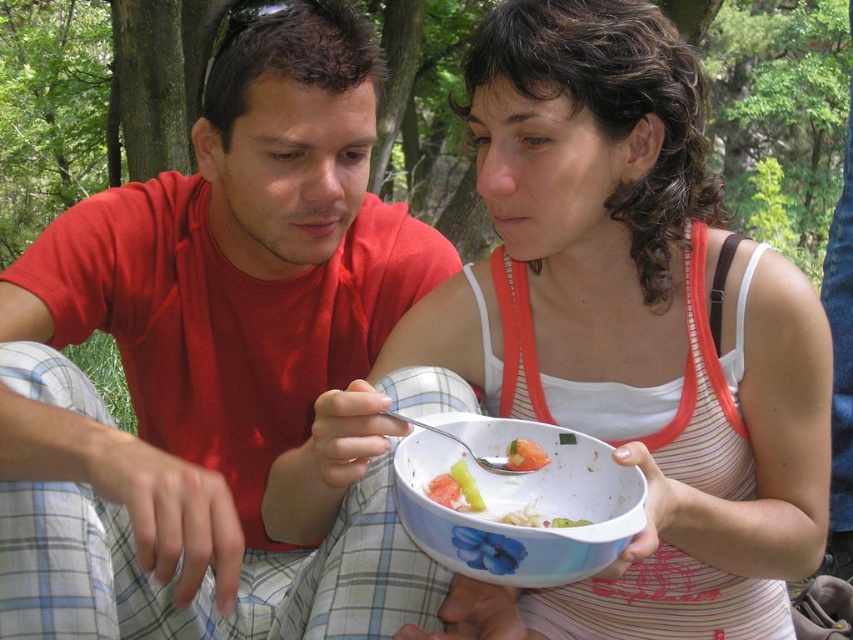
Does white fabric tank top at center have a greater width compared to green leafy vegetable at bowl center?

Correct, the width of white fabric tank top at center exceeds that of green leafy vegetable at bowl center.

Is white fabric tank top at center smaller than green leafy vegetable at bowl center?

Incorrect, white fabric tank top at center is not smaller in size than green leafy vegetable at bowl center.

Which is behind, point (643, 228) or point (508, 467)?

Point (643, 228)

Identify the location of white fabric tank top at center. (634, 328).

Describe the element at coordinates (200, 340) in the screenshot. The height and width of the screenshot is (640, 853). I see `matte red shirt at center` at that location.

At what (x,y) coordinates should I click in order to perform the action: click on matte red shirt at center. Please return your answer as a coordinate pair (x, y). This screenshot has height=640, width=853. Looking at the image, I should click on (200, 340).

Between point (271, 321) and point (538, 451), which one is positioned behind?

Point (271, 321)

Is point (177, 550) positioned behind point (517, 456)?

No.

The height and width of the screenshot is (640, 853). What are the coordinates of `matte red shirt at center` in the screenshot? It's located at (200, 340).